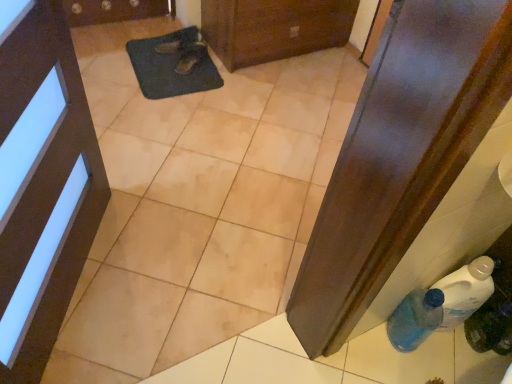
Identify the location of vacant space to the right of matte black door at upper left, positioned as the second door in right-to-left order. The width and height of the screenshot is (512, 384). (203, 294).